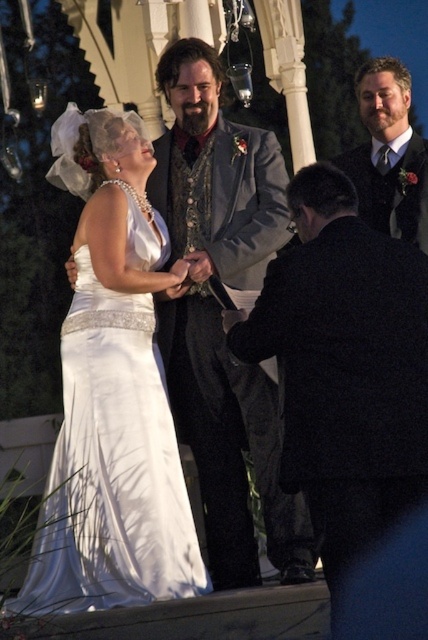
You are a photographer setting up for a wedding photo. You need to position a backdrop that is 3 feet wide. The white satin dress at center and the matte gray vest at center are in the frame. Will the backdrop be wide enough to accommodate both objects without cropping either?

The white satin dress at center might be wider than the matte gray vest at center, so the 3 feet wide backdrop may not be sufficient if the dress is wider. Check the actual width of the dress to confirm.

You are standing at the position of the viewer in the wedding scene. There is a black wool coat at lower right. Can you pick up the coat without moving your feet?

The black wool coat at lower right is 157.04 feet away from you, so you cannot reach it without moving your feet.